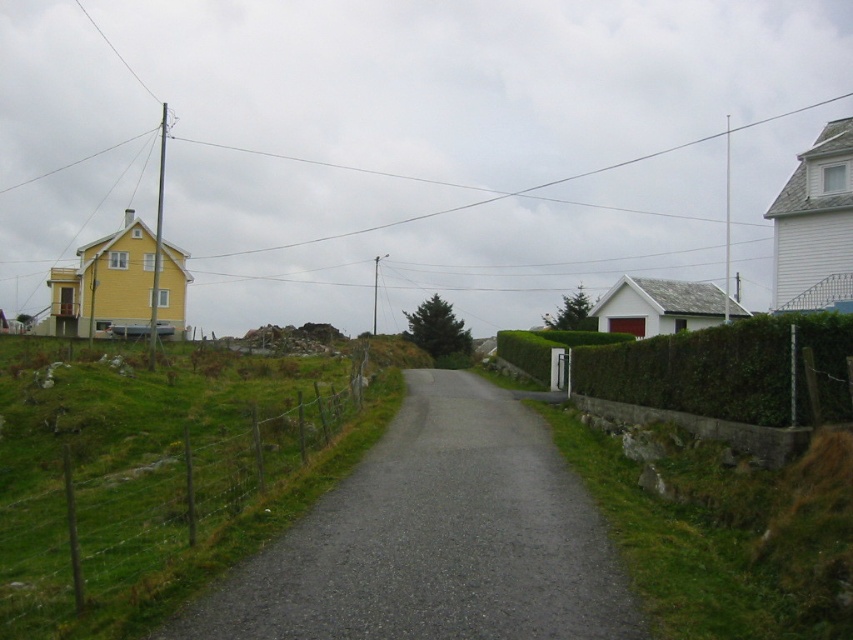
How much distance is there between gray asphalt driveway at center and green wire fence at center?

gray asphalt driveway at center is 13.74 feet from green wire fence at center.

Does gray asphalt driveway at center have a larger size compared to green wire fence at center?

Incorrect, gray asphalt driveway at center is not larger than green wire fence at center.

Where is `gray asphalt driveway at center`? This screenshot has height=640, width=853. gray asphalt driveway at center is located at coordinates (434, 540).

Can you confirm if green wire fence at center is positioned to the left of green hedge at right?

Correct, you'll find green wire fence at center to the left of green hedge at right.

Which is below, green wire fence at center or green hedge at right?

green wire fence at center

Which is behind, point (76, 593) or point (730, 390)?

The point (730, 390) is behind.

I want to click on green wire fence at center, so click(x=149, y=502).

Can you confirm if gray asphalt driveway at center is positioned below green hedge at right?

Yes, gray asphalt driveway at center is below green hedge at right.

Which of these two, gray asphalt driveway at center or green hedge at right, stands shorter?

Standing shorter between the two is gray asphalt driveway at center.

Describe the element at coordinates (434, 540) in the screenshot. Image resolution: width=853 pixels, height=640 pixels. I see `gray asphalt driveway at center` at that location.

The height and width of the screenshot is (640, 853). Find the location of `gray asphalt driveway at center`. gray asphalt driveway at center is located at coordinates (434, 540).